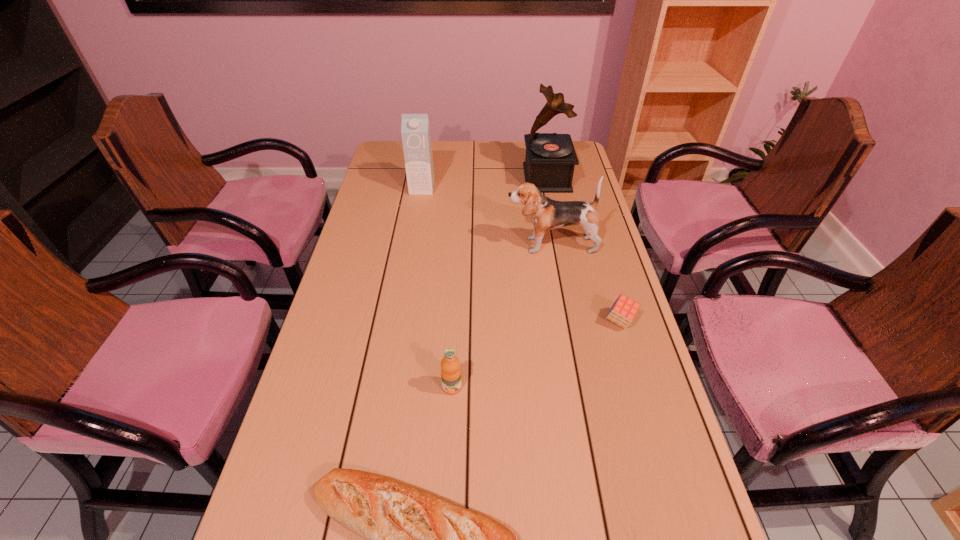
This screenshot has height=540, width=960. I want to click on free space located 0.320m at the face of the fourth nearest object, so click(405, 245).

You are a GUI agent. You are given a task and a screenshot of the screen. Output one action in this format:
    pyautogui.click(x=<x>, y=<y>)
    Task: Click on the vacant point located 0.270m at the face of the fourth nearest object
    
    Given the screenshot: What is the action you would take?
    tap(421, 245)

The width and height of the screenshot is (960, 540). What are the coordinates of `blank area located 0.170m at the face of the fourth nearest object` in the screenshot? It's located at (452, 245).

Identify the location of vacant space located 0.290m on the label of the fifth farthest object. This screenshot has height=540, width=960. (444, 535).

Where is `vacant space located 0.390m on the left of the third nearest object`? vacant space located 0.390m on the left of the third nearest object is located at coordinates (459, 321).

Where is `object at the far edge`? Image resolution: width=960 pixels, height=540 pixels. object at the far edge is located at coordinates (550, 159).

Where is `object present at the left edge`? The width and height of the screenshot is (960, 540). object present at the left edge is located at coordinates (415, 128).

Identify the location of phonograph_record situated at the right edge. This screenshot has width=960, height=540. (550, 159).

The width and height of the screenshot is (960, 540). I want to click on puppy situated at the right edge, so click(x=547, y=214).

Locate an element on the screen. cube that is at the right edge is located at coordinates (623, 311).